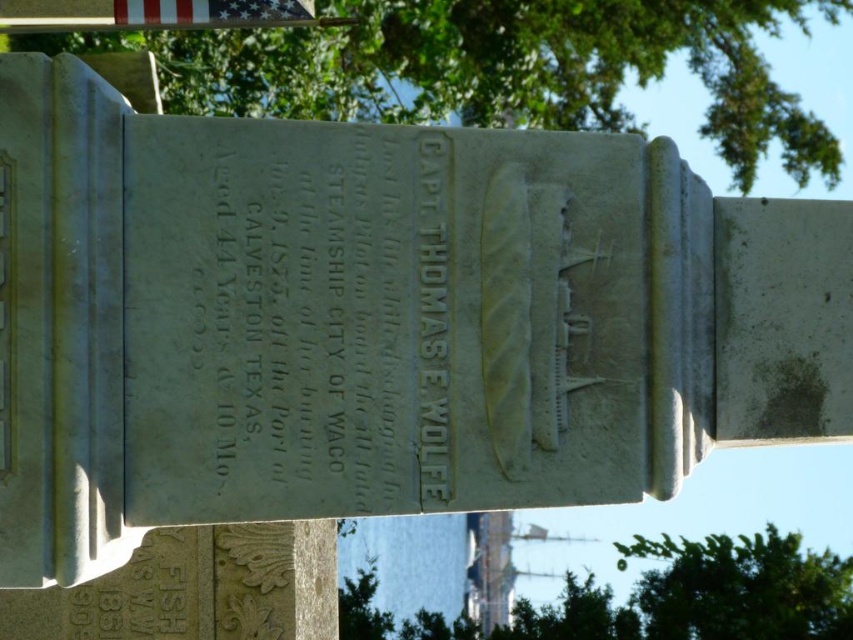
You are a photographer aiming to capture a clear photo of the monument. You notice two green leafy trees in the frame. Which tree, the green leafy tree at upper center or the green leafy tree at center, is taller and might block the monument if not trimmed?

The green leafy tree at upper center is taller than the green leafy tree at center, so it might block the monument if not trimmed.

What is the coordinate of the green leafy tree at center?

The green leafy tree at center is located at coordinate point (657,596).